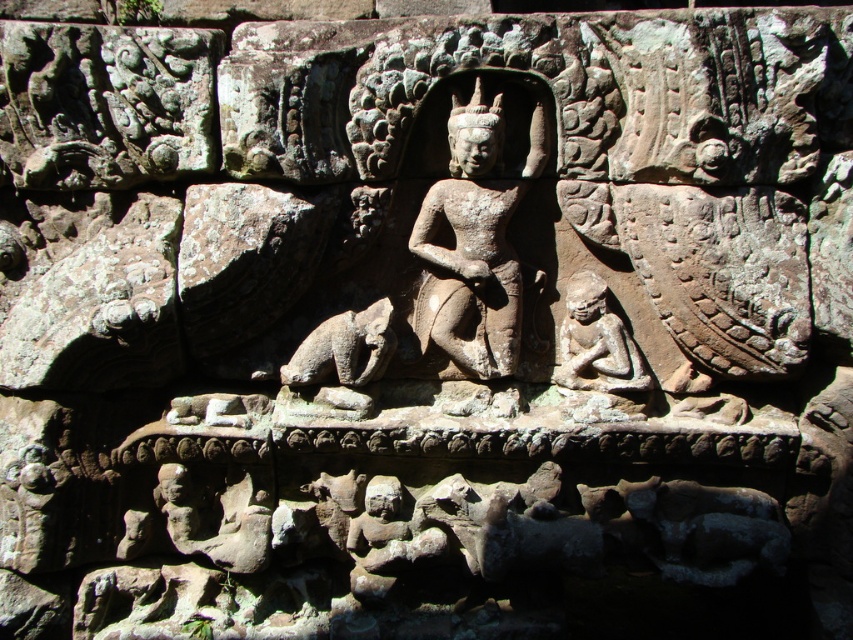
Is the position of carved stone figure at center less distant than that of brown stone dog at center?

No, it is behind brown stone dog at center.

Can you confirm if carved stone figure at center is wider than brown stone dog at center?

Incorrect, carved stone figure at center's width does not surpass brown stone dog at center's.

Locate an element on the screen. carved stone figure at center is located at coordinates (596, 342).

The height and width of the screenshot is (640, 853). Identify the location of carved stone figure at center. (596, 342).

Does gray stone statue at center have a greater height compared to carved stone figure at center?

Yes.

Does gray stone statue at center appear on the left side of carved stone figure at center?

Correct, you'll find gray stone statue at center to the left of carved stone figure at center.

Where is `gray stone statue at center`? gray stone statue at center is located at coordinates (474, 241).

I want to click on gray stone statue at center, so (474, 241).

Does gray stone statue at center have a lesser height compared to brown stone dog at center?

No, gray stone statue at center is not shorter than brown stone dog at center.

Between gray stone statue at center and brown stone dog at center, which one is positioned lower?

Positioned lower is brown stone dog at center.

Between point (467, 248) and point (352, 312), which one is positioned behind?

Point (352, 312)

At what (x,y) coordinates should I click in order to perform the action: click on gray stone statue at center. Please return your answer as a coordinate pair (x, y). Looking at the image, I should click on (474, 241).